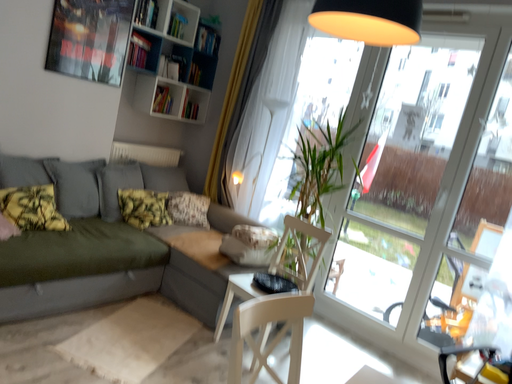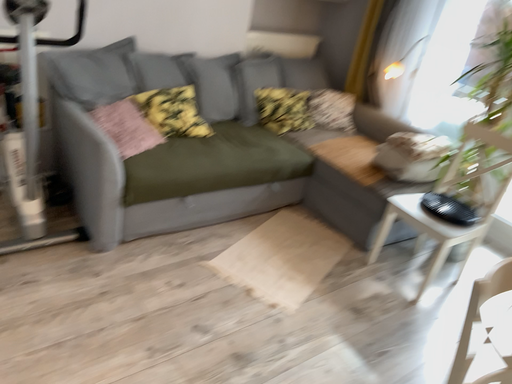
Question: How did the camera likely rotate when shooting the video?

Choices:
 (A) rotated downward
 (B) rotated upward

Answer: (A)